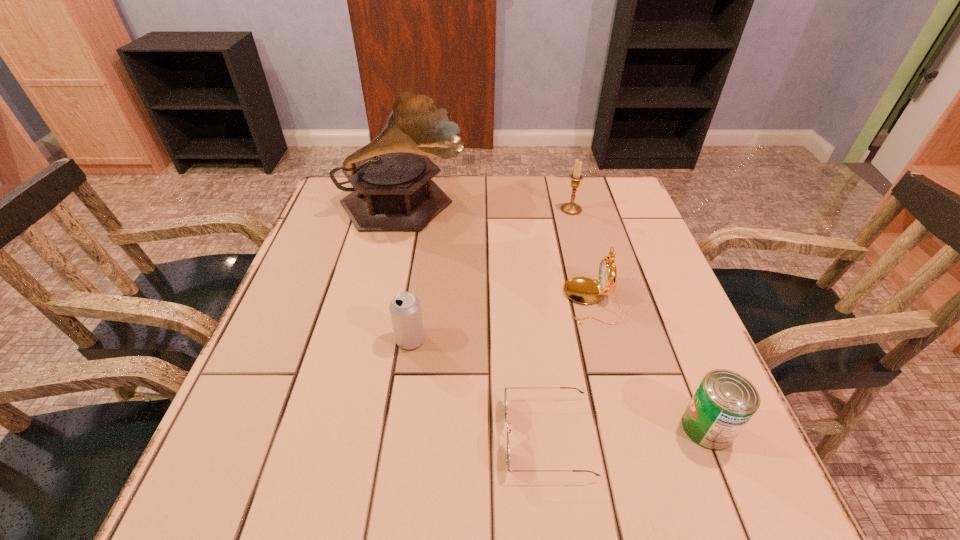
Identify the location of object present at the left edge. (393, 190).

The width and height of the screenshot is (960, 540). Find the location of `candle holder that is positioned at the right edge`. candle holder that is positioned at the right edge is located at coordinates (571, 208).

Where is `pocket watch that is at the right edge`? pocket watch that is at the right edge is located at coordinates (583, 290).

Locate an element on the screen. The height and width of the screenshot is (540, 960). can that is at the right edge is located at coordinates (725, 401).

You are a GUI agent. You are given a task and a screenshot of the screen. Output one action in this format:
    pyautogui.click(x=<x>, y=<y>)
    Task: Click on the object present at the far left corner
    The height and width of the screenshot is (540, 960).
    Given the screenshot: What is the action you would take?
    pyautogui.click(x=393, y=190)

At what (x,y) coordinates should I click in order to perform the action: click on object that is at the far right corner. Please return your answer as a coordinate pair (x, y). Looking at the image, I should click on (571, 208).

Where is `vacant space at the far edge of the desktop`? vacant space at the far edge of the desktop is located at coordinates (490, 220).

You are a GUI agent. You are given a task and a screenshot of the screen. Output one action in this format:
    pyautogui.click(x=<x>, y=<y>)
    Task: Click on the free space at the near edge of the desktop
    Image resolution: width=960 pixels, height=540 pixels.
    Given the screenshot: What is the action you would take?
    pyautogui.click(x=427, y=470)

In the image, there is a desktop. Identify the location of vacant space at the right edge. (624, 339).

Where is `vacant region at the far left corner of the desktop`? vacant region at the far left corner of the desktop is located at coordinates (335, 210).